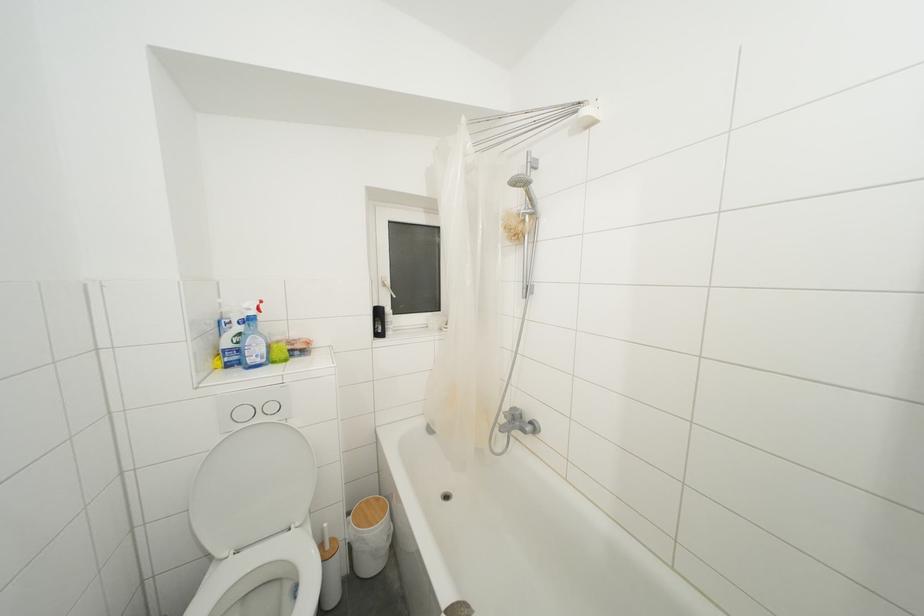
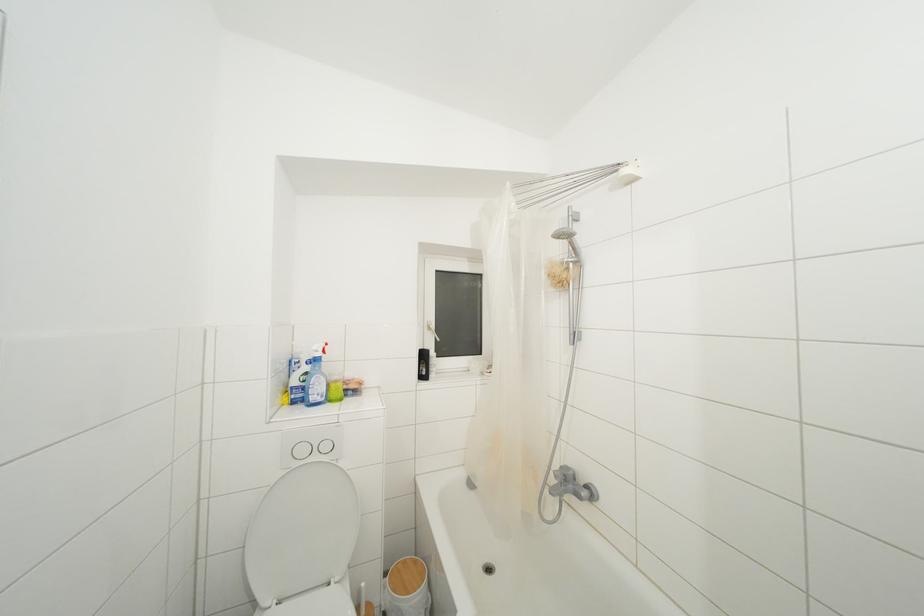
Find the pixel in the second image that matches (x=249, y=418) in the first image.

(307, 456)